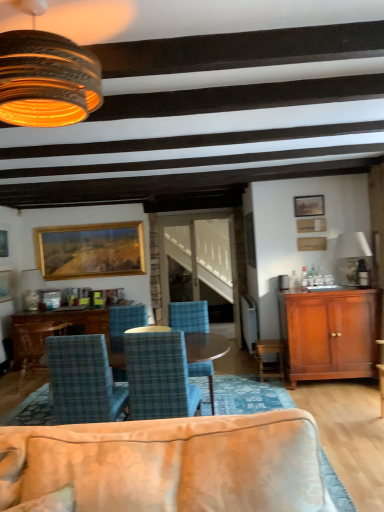
This screenshot has height=512, width=384. Find the location of `rustic wood lampshade at upper left, the 2th lamp from the back`. rustic wood lampshade at upper left, the 2th lamp from the back is located at coordinates (46, 77).

Describe the element at coordinates (46, 77) in the screenshot. Image resolution: width=384 pixels, height=512 pixels. I see `rustic wood lampshade at upper left, positioned as the 2th lamp in bottom-to-top order` at that location.

Measure the distance between gold-framed painting at left, which is the 4th picture frame in right-to-left order, and camera.

gold-framed painting at left, which is the 4th picture frame in right-to-left order, is 18.46 feet from camera.

Identify the location of blue plaid chair at center, positioned as the first chair in left-to-right order. The width and height of the screenshot is (384, 512). (34, 344).

What is the approximate height of wooden table at center?

wooden table at center is 30.45 inches in height.

What do you see at coordinates (330, 334) in the screenshot? I see `mahogany wood cabinet at right` at bounding box center [330, 334].

What is the approximate height of mahogany wood cabinet at right?

mahogany wood cabinet at right is 39.12 inches tall.

The width and height of the screenshot is (384, 512). What do you see at coordinates (201, 257) in the screenshot? I see `transparent glass door at center` at bounding box center [201, 257].

Image resolution: width=384 pixels, height=512 pixels. Find the location of `transparent glass door at center`. transparent glass door at center is located at coordinates (201, 257).

Identify the location of blue plaid chair at center, the third chair viewed from the left. This screenshot has height=512, width=384. (159, 376).

Can you confirm if mahogany wood cabinet at right is shorter than blue plaid chair at center, the third chair when ordered from right to left?

No.

Does mahogany wood cabinet at right have a greater width compared to blue plaid chair at center, which is counted as the 2th chair, starting from the front?

Indeed, mahogany wood cabinet at right has a greater width compared to blue plaid chair at center, which is counted as the 2th chair, starting from the front.

Between mahogany wood cabinet at right and blue plaid chair at center, the third chair when ordered from right to left, which one is positioned behind?

mahogany wood cabinet at right is more distant.

Between point (304, 246) and point (123, 362), which one is positioned in front?

Positioned in front is point (123, 362).

From the image's perspective, which picture frame is the 3rd one above the wooden table at center? Please provide its 2D coordinates.

[(312, 244)]

Is wooden picture frame at upper right, placed as the second picture frame when sorted from front to back, turned away from wooden table at center?

wooden picture frame at upper right, placed as the second picture frame when sorted from front to back, is not turned away from wooden table at center.

Considering the positions of points (208, 377) and (358, 258), is point (208, 377) farther from camera compared to point (358, 258)?

No.

Is blue plaid chair at center, the 1th chair in the right-to-left sequence, next to white fabric lampshade at upper right, marked as the 1th lamp in a right-to-left arrangement, and touching it?

No.

Between blue plaid chair at center, the 1th chair in the right-to-left sequence, and white fabric lampshade at upper right, marked as the second lamp in a front-to-back arrangement, which one has larger width?

blue plaid chair at center, the 1th chair in the right-to-left sequence.

Where is `the 3rd chair in front of the wooden table at center`? the 3rd chair in front of the wooden table at center is located at coordinates (83, 380).

Consider the image. From the image's perspective, is wooden table at center located above blue plaid chair at center, which is counted as the 2th chair, starting from the front?

No, from the image's perspective, wooden table at center is not above blue plaid chair at center, which is counted as the 2th chair, starting from the front.

Could you tell me if wooden table at center is turned towards blue plaid chair at center, the third chair when ordered from right to left?

Yes, wooden table at center is facing blue plaid chair at center, the third chair when ordered from right to left.

Is wooden table at center positioned beyond the bounds of blue plaid chair at center, the 3th chair viewed from the back?

Yes, wooden table at center is not within blue plaid chair at center, the 3th chair viewed from the back.

Between mahogany wood cabinet at right and blue plaid chair at center, the 1th chair in the front-to-back sequence, which one has smaller size?

Smaller between the two is blue plaid chair at center, the 1th chair in the front-to-back sequence.

Is mahogany wood cabinet at right facing away from blue plaid chair at center, the third chair viewed from the left?

No, blue plaid chair at center, the third chair viewed from the left, is not at the back of mahogany wood cabinet at right.

Is mahogany wood cabinet at right not within blue plaid chair at center, the third chair viewed from the left?

Yes.

From the image's perspective, which one is positioned lower, blue plaid chair at center, the 1th chair in the right-to-left sequence, or mahogany wood cabinet at right?

blue plaid chair at center, the 1th chair in the right-to-left sequence, from the image's perspective.

Is blue plaid chair at center, the 1th chair in the right-to-left sequence, further to camera compared to mahogany wood cabinet at right?

No, it is in front of mahogany wood cabinet at right.

Based on the photo, which of these two, blue plaid chair at center, which is the 4th chair from left to right, or mahogany wood cabinet at right, is thinner?

Thinner between the two is blue plaid chair at center, which is the 4th chair from left to right.

Can we say blue plaid chair at center, the third chair when ordered from front to back, lies outside mahogany wood cabinet at right?

Yes, blue plaid chair at center, the third chair when ordered from front to back, is outside of mahogany wood cabinet at right.

Considering the sizes of transparent glass door at center and blue plaid chair at center, the 1th chair in the front-to-back sequence, in the image, is transparent glass door at center bigger or smaller than blue plaid chair at center, the 1th chair in the front-to-back sequence,?

transparent glass door at center is smaller than blue plaid chair at center, the 1th chair in the front-to-back sequence.

Does transparent glass door at center turn towards blue plaid chair at center, arranged as the fourth chair when viewed from the back?

Yes, transparent glass door at center is facing blue plaid chair at center, arranged as the fourth chair when viewed from the back.

Which of these two, transparent glass door at center or blue plaid chair at center, which ranks as the 2th chair in right-to-left order, is wider?

With larger width is blue plaid chair at center, which ranks as the 2th chair in right-to-left order.

From the image's perspective, is transparent glass door at center located above or below blue plaid chair at center, the third chair viewed from the left?

Clearly, from the image's perspective, transparent glass door at center is above blue plaid chair at center, the third chair viewed from the left.

From a real-world perspective, starting from the mahogany wood cabinet at right, which chair is the 2nd one vertically above it? Please provide its 2D coordinates.

[(83, 380)]

Where is `table below the wooden picture frame at upper right, the 4th picture frame viewed from the left (from a real-world perspective)`? table below the wooden picture frame at upper right, the 4th picture frame viewed from the left (from a real-world perspective) is located at coordinates (78, 324).

From the image, which object appears to be nearer to gold wooden picture frame at upper left, which is the 2th picture frame from left to right, rustic wood lampshade at upper left, marked as the 1th lamp in a front-to-back arrangement, or gold-framed painting at left, which is the 4th picture frame in right-to-left order?

gold-framed painting at left, which is the 4th picture frame in right-to-left order, is positioned closer to the anchor gold wooden picture frame at upper left, which is the 2th picture frame from left to right.

Consider the image. Based on their spatial positions, is gold wooden picture frame at upper left, marked as the 4th picture frame in a front-to-back arrangement, or mahogany wood cabinet at right closer to blue plaid chair at center, which appears as the 1th chair when viewed from the back?

gold wooden picture frame at upper left, marked as the 4th picture frame in a front-to-back arrangement.

When comparing their distances from mahogany wood cabinet at right, does gold wooden picture frame at upper left, placed as the third picture frame when sorted from right to left, or blue plaid chair at center, the third chair viewed from the left, seem closer?

blue plaid chair at center, the third chair viewed from the left.

From the image, which object appears to be farther from white fabric lampshade at upper right, the 1th lamp positioned from the bottom, blue plaid chair at center, the third chair when ordered from right to left, or mahogany wood cabinet at right?

blue plaid chair at center, the third chair when ordered from right to left, is positioned further to the anchor white fabric lampshade at upper right, the 1th lamp positioned from the bottom.

Estimate the real-world distances between objects in this image. Which object is further from white fabric lampshade at upper right, marked as the second lamp in a front-to-back arrangement, blue plaid chair at center, the 1th chair in the right-to-left sequence, or mahogany wood cabinet at right?

The object further to white fabric lampshade at upper right, marked as the second lamp in a front-to-back arrangement, is blue plaid chair at center, the 1th chair in the right-to-left sequence.

Looking at the image, which one is located closer to rustic wood lampshade at upper left, the 2th lamp from the back, blue plaid chair at center, positioned as the first chair in left-to-right order, or gold wooden picture frame at upper left, which is the 2th picture frame from left to right?

Among the two, gold wooden picture frame at upper left, which is the 2th picture frame from left to right, is located nearer to rustic wood lampshade at upper left, the 2th lamp from the back.

Based on their spatial positions, is transparent glass door at center or blue plaid chair at center, which appears as the 1th chair when viewed from the back, further from rustic wood lampshade at upper left, marked as the 1th lamp in a front-to-back arrangement?

The object further to rustic wood lampshade at upper left, marked as the 1th lamp in a front-to-back arrangement, is blue plaid chair at center, which appears as the 1th chair when viewed from the back.

Considering their positions, is blue plaid chair at center, arranged as the 2th chair when viewed from the left, positioned closer to blue plaid chair at center, which is the 4th chair from left to right, than gold wooden picture frame at upper left, marked as the 4th picture frame in a front-to-back arrangement?

blue plaid chair at center, arranged as the 2th chair when viewed from the left, lies closer to blue plaid chair at center, which is the 4th chair from left to right, than the other object.

This screenshot has height=512, width=384. In order to click on chair between blue plaid chair at center, the 3th chair viewed from the back, and blue plaid chair at center, positioned as the first chair in left-to-right order, along the z-axis in this screenshot , I will do `click(189, 316)`.

Where is `chair situated between blue plaid chair at center, which ranks as the 2th chair in right-to-left order, and mahogany wood cabinet at right from left to right`? chair situated between blue plaid chair at center, which ranks as the 2th chair in right-to-left order, and mahogany wood cabinet at right from left to right is located at coordinates (189, 316).

You are a GUI agent. You are given a task and a screenshot of the screen. Output one action in this format:
    pyautogui.click(x=<x>, y=<y>)
    Task: Click on the cabinetry between blue plaid chair at center, arranged as the fourth chair when viewed from the back, and transparent glass door at center from front to back
    Image resolution: width=384 pixels, height=512 pixels.
    Given the screenshot: What is the action you would take?
    click(x=330, y=334)

Image resolution: width=384 pixels, height=512 pixels. I want to click on glass door between wooden table at center and mahogany wood cabinet at right in the horizontal direction, so click(201, 257).